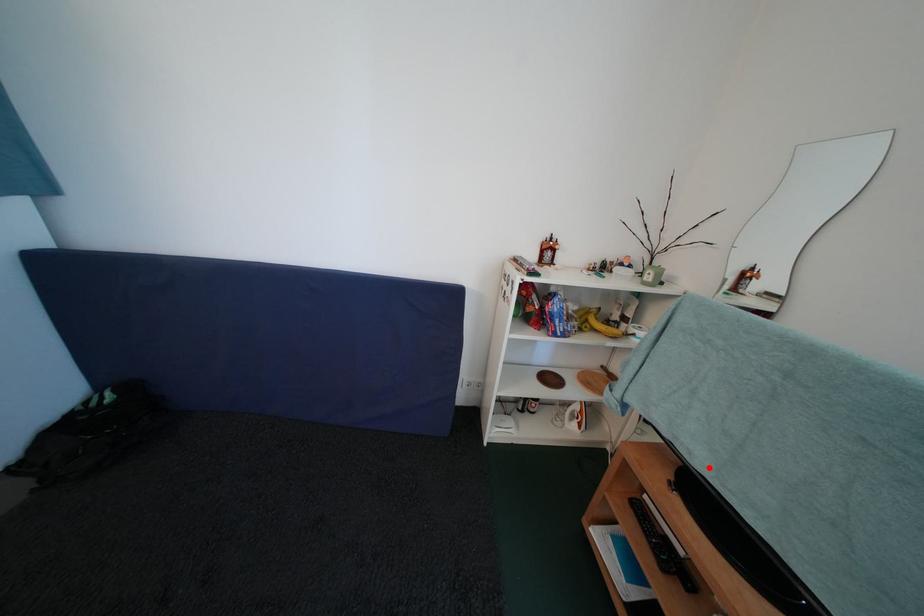
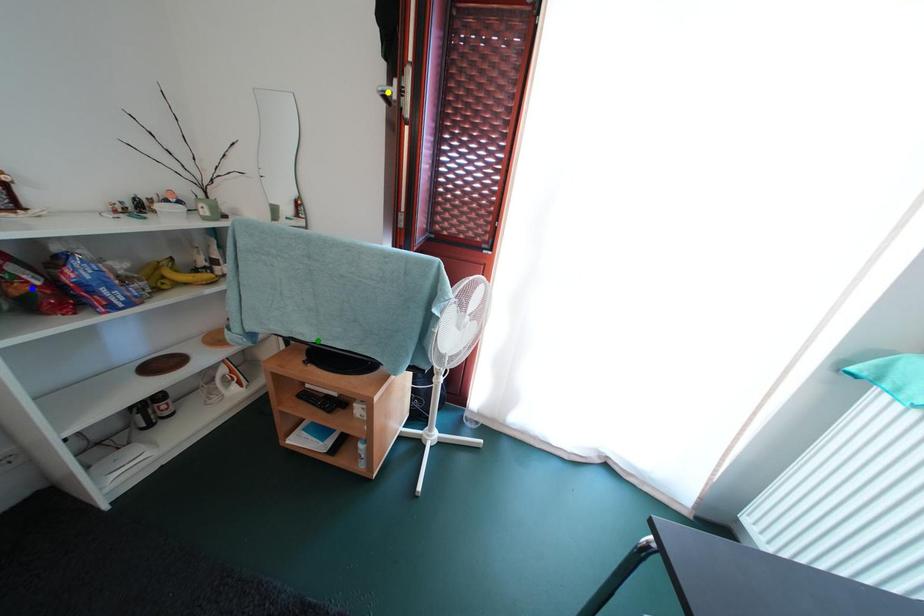
Question: I am providing you with two images of the same scene from different viewpoints. A red point is marked on the first image. You are given multiple points on the second image. Which spot in image 2 lines up with the point in image 1?

Choices:
 (A) green point
 (B) blue point
 (C) yellow point

Answer: (A)